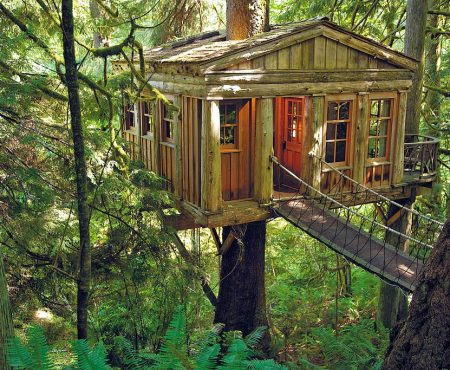
At what (x,y) coordinates should I click in order to perform the action: click on door. Please return your answer as a coordinate pair (x, y). Image resolution: width=450 pixels, height=370 pixels. Looking at the image, I should click on (292, 136).